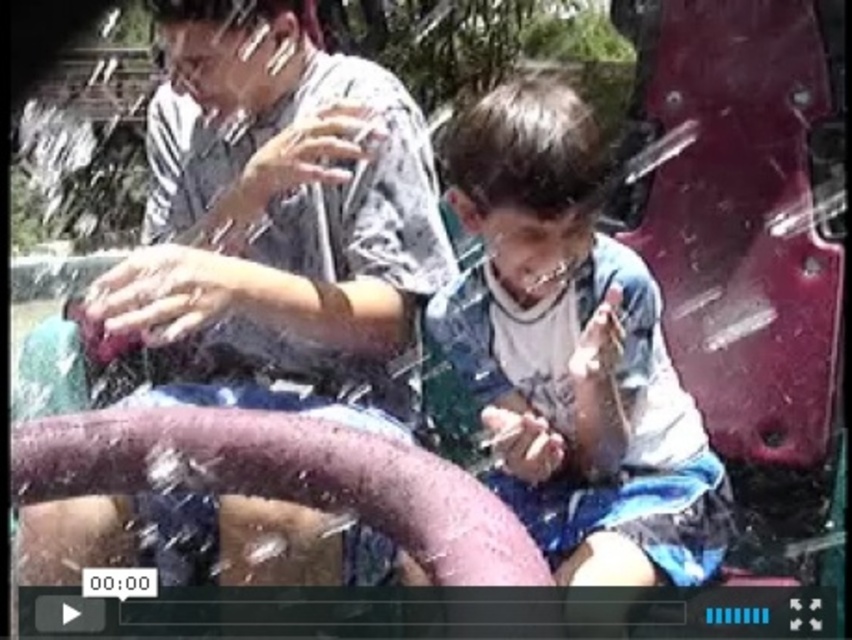
You are a photographer trying to capture a candid shot of the matte gray shirt at center. Based on its position at coordinates point 0.358, 0.331, where should you aim your camera to ensure the shirt is in the frame?

The matte gray shirt at center is located at point [281,228], so aim your camera towards the center of the image where the coordinates indicate the shirt is positioned.

You are trying to decide which clothing item to take with you for a hiking trip where space is limited. Given the scene described, which item between the matte gray shirt at center and the blue denim shorts at center would you choose to pack if you prioritize taking the wider clothing item?

The matte gray shirt at center is wider than the blue denim shorts at center, so you should pack the matte gray shirt at center since it is wider.

You are standing at the point marked by coordinates point (x=281, y=228) in the image. What object is directly in front of you?

The point (x=281, y=228) marks the matte gray shirt at center, so the object directly in front of you is the matte gray shirt at center.